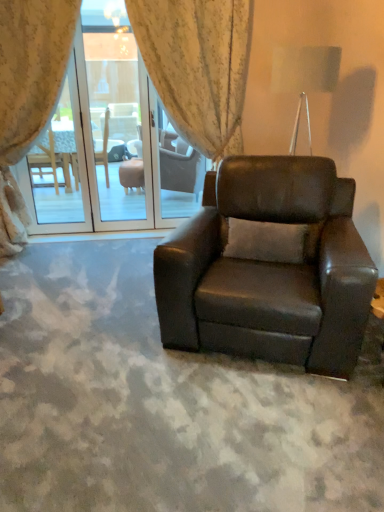
This screenshot has height=512, width=384. Find the location of `floral fabric curtain at center, which is the first curtain in right-to-left order`. floral fabric curtain at center, which is the first curtain in right-to-left order is located at coordinates (198, 66).

I want to click on floral fabric curtain at upper left, which appears as the second curtain when viewed from the right, so click(x=28, y=93).

From a real-world perspective, is floral fabric curtain at upper left, which ranks as the 1th curtain in left-to-right order, beneath matte black armchair at center?

No, from a real-world perspective, floral fabric curtain at upper left, which ranks as the 1th curtain in left-to-right order, is not below matte black armchair at center.

Is floral fabric curtain at upper left, which ranks as the 1th curtain in left-to-right order, taller than matte black armchair at center?

Yes.

Measure the distance from floral fabric curtain at upper left, which appears as the second curtain when viewed from the right, to matte black armchair at center.

A distance of 1.98 meters exists between floral fabric curtain at upper left, which appears as the second curtain when viewed from the right, and matte black armchair at center.

Is matte black armchair at center at the back of floral fabric curtain at upper left, which appears as the second curtain when viewed from the right?

No, floral fabric curtain at upper left, which appears as the second curtain when viewed from the right,'s orientation is not away from matte black armchair at center.

Considering the positions of points (104, 90) and (234, 338), is point (104, 90) farther from camera compared to point (234, 338)?

That is True.

Considering the relative sizes of transparent glass screen door at center and matte black armchair at center in the image provided, is transparent glass screen door at center taller than matte black armchair at center?

Yes, transparent glass screen door at center is taller than matte black armchair at center.

Image resolution: width=384 pixels, height=512 pixels. Identify the location of screen door that is on the left side of matte black armchair at center. (115, 141).

Is transparent glass screen door at center smaller than matte black armchair at center?

Correct, transparent glass screen door at center occupies less space than matte black armchair at center.

Is matte black armchair at center not close to transparent glass screen door at center?

Yes, matte black armchair at center is far from transparent glass screen door at center.

Can you tell me how much matte black armchair at center and transparent glass screen door at center differ in facing direction?

23.6 degrees separate the facing orientations of matte black armchair at center and transparent glass screen door at center.

From the image's perspective, which one is positioned lower, matte black armchair at center or transparent glass screen door at center?

matte black armchair at center appears lower in the image.

Considering the sizes of matte black armchair at center and floral fabric curtain at center, which is the first curtain in right-to-left order, in the image, is matte black armchair at center taller or shorter than floral fabric curtain at center, which is the first curtain in right-to-left order,?

In the image, matte black armchair at center appears to be shorter than floral fabric curtain at center, which is the first curtain in right-to-left order.

Can you confirm if matte black armchair at center is positioned to the right of floral fabric curtain at center, the second curtain viewed from the left?

Correct, you'll find matte black armchair at center to the right of floral fabric curtain at center, the second curtain viewed from the left.

From the picture: Does matte black armchair at center turn towards floral fabric curtain at center, the second curtain viewed from the left?

No, matte black armchair at center is not aimed at floral fabric curtain at center, the second curtain viewed from the left.

Based on the photo, how distant is floral fabric curtain at center, which is the first curtain in right-to-left order, from matte black armchair at center?

floral fabric curtain at center, which is the first curtain in right-to-left order, is 4.37 feet away from matte black armchair at center.

Who is taller, floral fabric curtain at center, which is the first curtain in right-to-left order, or matte black armchair at center?

floral fabric curtain at center, which is the first curtain in right-to-left order, is taller.

Does point (132, 24) appear closer or farther from the camera than point (209, 337)?

Point (132, 24) is positioned farther from the camera compared to point (209, 337).

Which curtain is the 2nd one when counting from the back of the matte black armchair at center? Please provide its 2D coordinates.

[(198, 66)]

Considering the sizes of floral fabric curtain at center, which is the first curtain in right-to-left order, and transparent glass screen door at center in the image, is floral fabric curtain at center, which is the first curtain in right-to-left order, bigger or smaller than transparent glass screen door at center?

floral fabric curtain at center, which is the first curtain in right-to-left order, is bigger than transparent glass screen door at center.

This screenshot has height=512, width=384. Identify the location of screen door above the floral fabric curtain at center, the second curtain viewed from the left (from a real-world perspective). (115, 141).

Considering the relative sizes of floral fabric curtain at center, which is the first curtain in right-to-left order, and transparent glass screen door at center in the image provided, is floral fabric curtain at center, which is the first curtain in right-to-left order, wider than transparent glass screen door at center?

Yes, floral fabric curtain at center, which is the first curtain in right-to-left order, is wider than transparent glass screen door at center.

Considering the points (150, 34) and (188, 198), which point is in front, point (150, 34) or point (188, 198)?

The point (150, 34) is closer.

Can you see floral fabric curtain at center, which is the first curtain in right-to-left order, touching floral fabric curtain at upper left, which ranks as the 1th curtain in left-to-right order?

No.

This screenshot has width=384, height=512. What are the coordinates of `curtain that appears on the left of floral fabric curtain at center, which is the first curtain in right-to-left order` in the screenshot? It's located at (28, 93).

Does floral fabric curtain at center, which is the first curtain in right-to-left order, turn towards floral fabric curtain at upper left, which ranks as the 1th curtain in left-to-right order?

No.

Considering the relative sizes of floral fabric curtain at center, the second curtain viewed from the left, and floral fabric curtain at upper left, which appears as the second curtain when viewed from the right, in the image provided, is floral fabric curtain at center, the second curtain viewed from the left, smaller than floral fabric curtain at upper left, which appears as the second curtain when viewed from the right,?

Yes, floral fabric curtain at center, the second curtain viewed from the left, is smaller than floral fabric curtain at upper left, which appears as the second curtain when viewed from the right.

You are a GUI agent. You are given a task and a screenshot of the screen. Output one action in this format:
    pyautogui.click(x=<x>, y=<y>)
    Task: Click on the chair that is on the right side of floral fabric curtain at upper left, which appears as the second curtain when viewed from the right
    Image resolution: width=384 pixels, height=512 pixels.
    Given the screenshot: What is the action you would take?
    pyautogui.click(x=269, y=267)

This screenshot has height=512, width=384. What are the coordinates of `chair below the transparent glass screen door at center (from a real-world perspective)` in the screenshot? It's located at (269, 267).

Estimate the real-world distances between objects in this image. Which object is further from floral fabric curtain at upper left, which ranks as the 1th curtain in left-to-right order, matte black armchair at center or transparent glass screen door at center?

transparent glass screen door at center is further to floral fabric curtain at upper left, which ranks as the 1th curtain in left-to-right order.

Which object lies nearer to the anchor point floral fabric curtain at center, which is the first curtain in right-to-left order, floral fabric curtain at upper left, which appears as the second curtain when viewed from the right, or transparent glass screen door at center?

floral fabric curtain at upper left, which appears as the second curtain when viewed from the right, is closer to floral fabric curtain at center, which is the first curtain in right-to-left order.

Estimate the real-world distances between objects in this image. Which object is closer to floral fabric curtain at upper left, which ranks as the 1th curtain in left-to-right order, transparent glass screen door at center or floral fabric curtain at center, which is the first curtain in right-to-left order?

The object closer to floral fabric curtain at upper left, which ranks as the 1th curtain in left-to-right order, is floral fabric curtain at center, which is the first curtain in right-to-left order.

From the image, which object appears to be nearer to floral fabric curtain at center, the second curtain viewed from the left, matte black armchair at center or floral fabric curtain at upper left, which ranks as the 1th curtain in left-to-right order?

floral fabric curtain at upper left, which ranks as the 1th curtain in left-to-right order, is closer to floral fabric curtain at center, the second curtain viewed from the left.

From the image, which object appears to be nearer to floral fabric curtain at upper left, which ranks as the 1th curtain in left-to-right order, matte black armchair at center or floral fabric curtain at center, the second curtain viewed from the left?

Among the two, floral fabric curtain at center, the second curtain viewed from the left, is located nearer to floral fabric curtain at upper left, which ranks as the 1th curtain in left-to-right order.

Based on their spatial positions, is floral fabric curtain at center, the second curtain viewed from the left, or transparent glass screen door at center closer to floral fabric curtain at upper left, which appears as the second curtain when viewed from the right?

The object closer to floral fabric curtain at upper left, which appears as the second curtain when viewed from the right, is floral fabric curtain at center, the second curtain viewed from the left.

Estimate the real-world distances between objects in this image. Which object is closer to transparent glass screen door at center, matte black armchair at center or floral fabric curtain at upper left, which appears as the second curtain when viewed from the right?

Based on the image, floral fabric curtain at upper left, which appears as the second curtain when viewed from the right, appears to be nearer to transparent glass screen door at center.

Looking at the image, which one is located further to matte black armchair at center, transparent glass screen door at center or floral fabric curtain at upper left, which ranks as the 1th curtain in left-to-right order?

transparent glass screen door at center lies further to matte black armchair at center than the other object.

This screenshot has width=384, height=512. In order to click on curtain located between floral fabric curtain at upper left, which ranks as the 1th curtain in left-to-right order, and matte black armchair at center in the left-right direction in this screenshot , I will do `click(198, 66)`.

Locate an element on the screen. screen door located between floral fabric curtain at upper left, which ranks as the 1th curtain in left-to-right order, and floral fabric curtain at center, which is the first curtain in right-to-left order, in the left-right direction is located at coordinates (115, 141).

Locate an element on the screen. This screenshot has width=384, height=512. screen door situated between floral fabric curtain at upper left, which appears as the second curtain when viewed from the right, and matte black armchair at center from left to right is located at coordinates (115, 141).